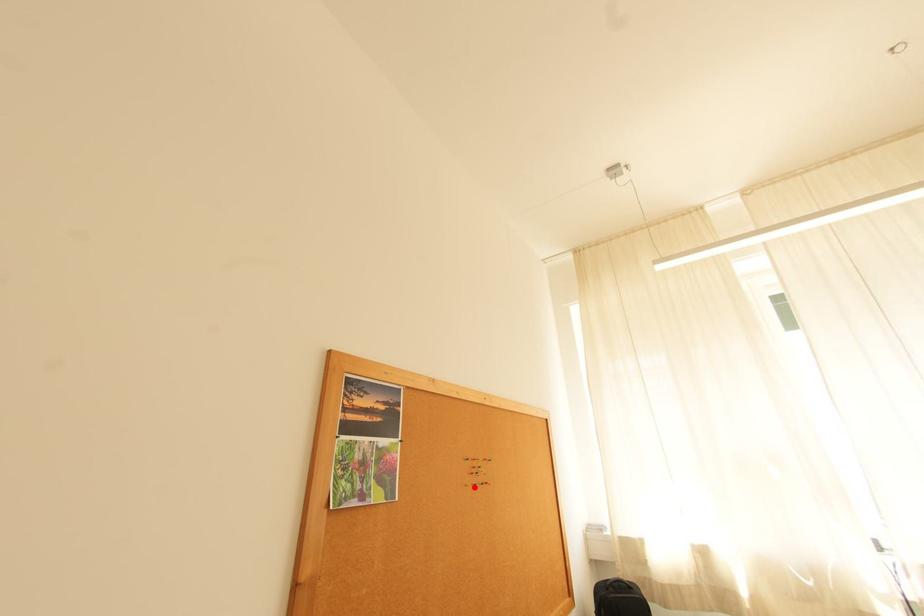
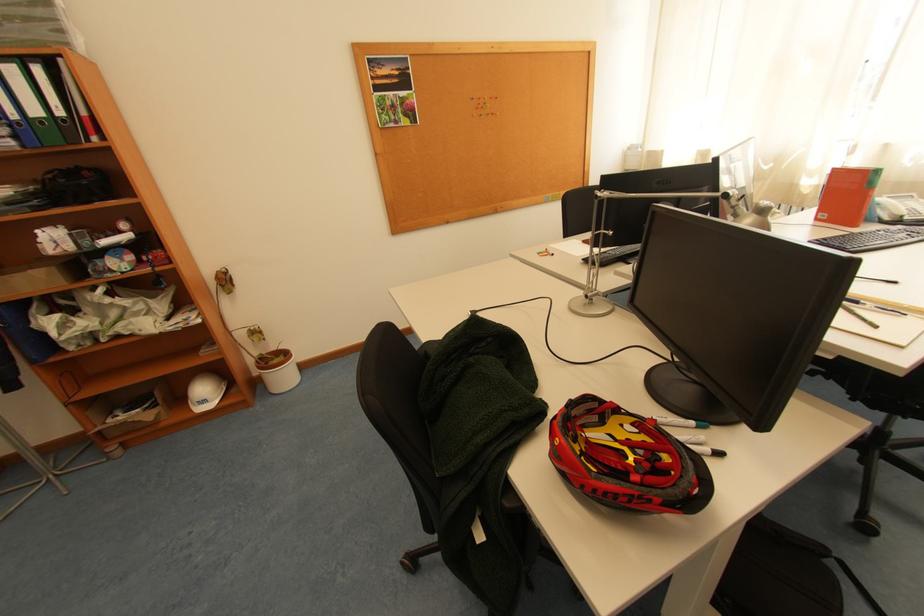
In the second image, find the point that corresponds to the highlighted location in the first image.

(481, 118)